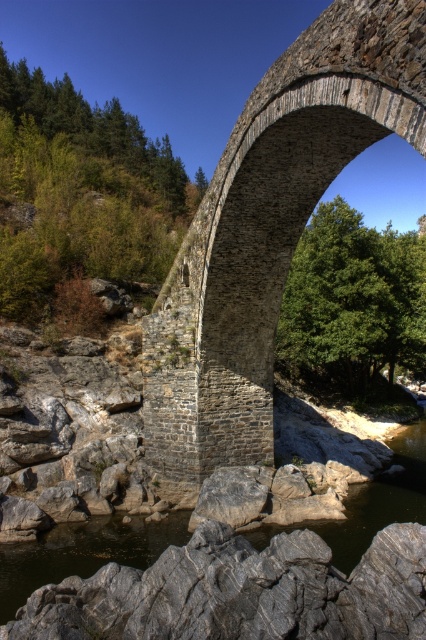
You are standing on the stone textured arch bridge at center and looking towards the gray stone river at lower center. Which object is closer to your viewpoint?

The stone textured arch bridge at center is closer to your viewpoint since it is in front of the gray stone river at lower center.

You are a hiker carrying a heavy backpack and want to cross the stone textured arch bridge at center to reach the gray stone river at lower center. Given that the bridge is 16.54 meters away from the river, is the bridge long enough to safely cross to the river without stepping into the water?

The distance between the stone textured arch bridge at center and the gray stone river at lower center is 16.54 meters. Since the bridge spans over the riverbed, its length should be sufficient to safely cross to the river without needing to step into the water.